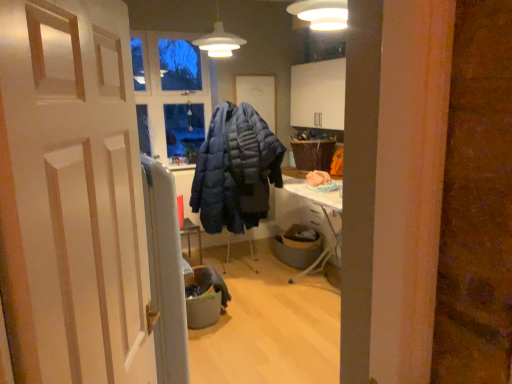
You are a GUI agent. You are given a task and a screenshot of the screen. Output one action in this format:
    pyautogui.click(x=<x>, y=<y>)
    Task: Click on the free region under matte blue puffer jacket at center (from a real-world perspective)
    
    Given the screenshot: What is the action you would take?
    pyautogui.click(x=249, y=271)